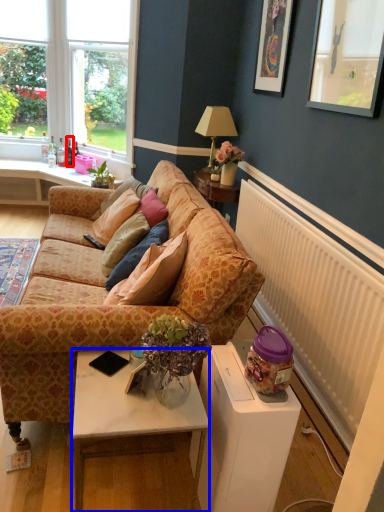
Question: Which point is further to the camera, bottle (highlighted by a red box) or table (highlighted by a blue box)?

Choices:
 (A) bottle
 (B) table

Answer: (A)